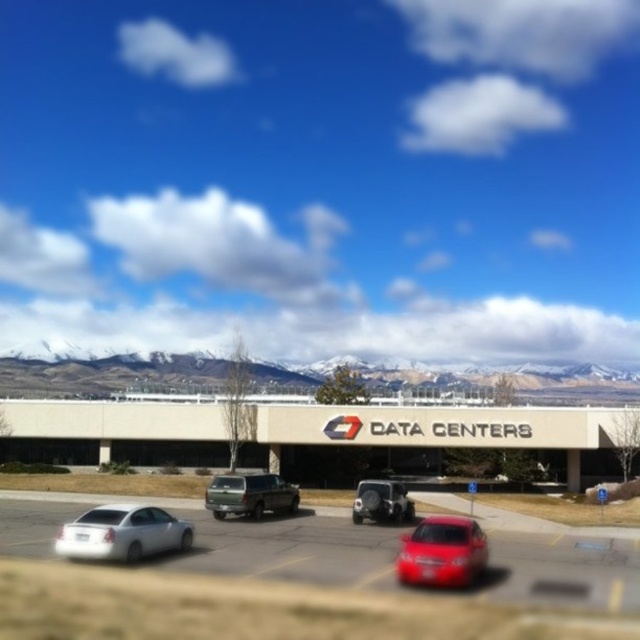
What do you see at coordinates (436, 435) in the screenshot? I see `beige concrete building at center` at bounding box center [436, 435].

Between point (244, 452) and point (360, 493), which one is positioned behind?

Positioned behind is point (244, 452).

Locate an element on the screen. This screenshot has width=640, height=640. beige concrete building at center is located at coordinates (436, 435).

Who is higher up, white matte sedan at lower left or green matte suv at center?

Positioned higher is white matte sedan at lower left.

Is white matte sedan at lower left above green matte suv at center?

Correct, white matte sedan at lower left is located above green matte suv at center.

Is point (129, 545) in front of point (259, 502)?

Yes, it is in front of point (259, 502).

Locate an element on the screen. This screenshot has width=640, height=640. white matte sedan at lower left is located at coordinates (122, 532).

Can you confirm if beige concrete building at center is bigger than green matte suv at center?

Yes.

From the picture: Is beige concrete building at center in front of green matte suv at center?

No, it is behind green matte suv at center.

Which is in front, point (104, 403) or point (240, 483)?

Point (240, 483) is more forward.

The width and height of the screenshot is (640, 640). Find the location of `beige concrete building at center`. beige concrete building at center is located at coordinates pyautogui.click(x=436, y=435).